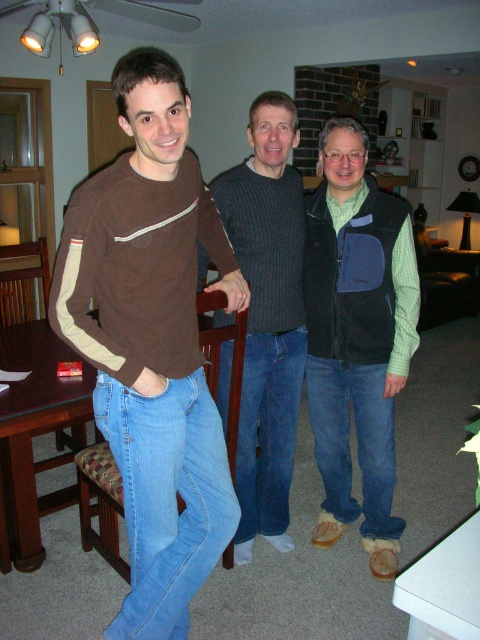
Question: Which of the following is the farthest from the observer?

Choices:
 (A) (312, 372)
 (B) (259, 253)
 (C) (84, 273)

Answer: (A)

Question: Where is green textured vest at center located in relation to dark gray ribbed sweater at center in the image?

Choices:
 (A) above
 (B) below

Answer: (B)

Question: Is green textured vest at center wider than brown wooden dining table at center?

Choices:
 (A) no
 (B) yes

Answer: (A)

Question: Among these objects, which one is farthest from the camera?

Choices:
 (A) green textured vest at center
 (B) brown wooden dining table at center
 (C) brown cotton shirt at center

Answer: (A)

Question: Is brown cotton shirt at center to the left of dark gray ribbed sweater at center from the viewer's perspective?

Choices:
 (A) yes
 (B) no

Answer: (A)

Question: Which is farther from the dark gray ribbed sweater at center?

Choices:
 (A) brown cotton shirt at center
 (B) green textured vest at center

Answer: (A)